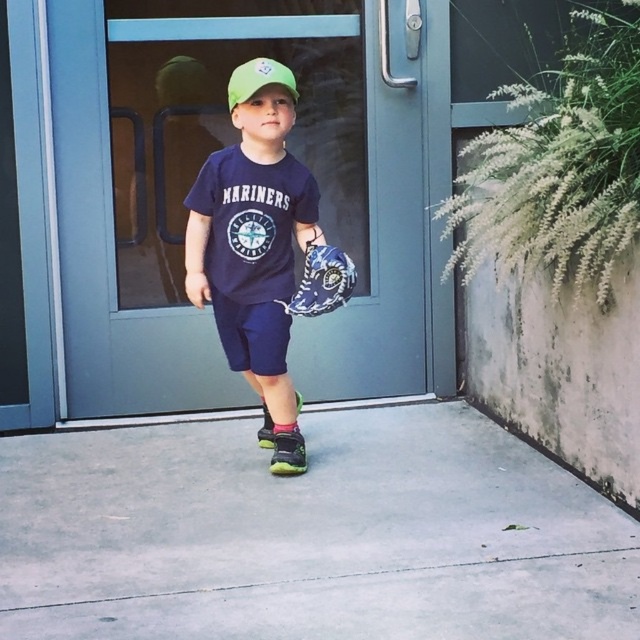
Question: Which point is closer to the camera taking this photo?

Choices:
 (A) tap(307, 266)
 (B) tap(100, 595)

Answer: (B)

Question: Can you confirm if matte blue shorts at center is positioned above blue fabric baseball glove at center?

Choices:
 (A) no
 (B) yes

Answer: (B)

Question: Considering the relative positions of gray concrete pavement at center and blue fabric baseball glove at center in the image provided, where is gray concrete pavement at center located with respect to blue fabric baseball glove at center?

Choices:
 (A) right
 (B) left

Answer: (B)

Question: Is blue matte door at center thinner than matte blue shorts at center?

Choices:
 (A) yes
 (B) no

Answer: (B)

Question: Which of the following is the closest to the observer?

Choices:
 (A) blue matte door at center
 (B) matte blue shorts at center

Answer: (B)

Question: Considering the real-world distances, which object is farthest from the matte blue shorts at center?

Choices:
 (A) blue matte door at center
 (B) blue fabric baseball glove at center

Answer: (A)